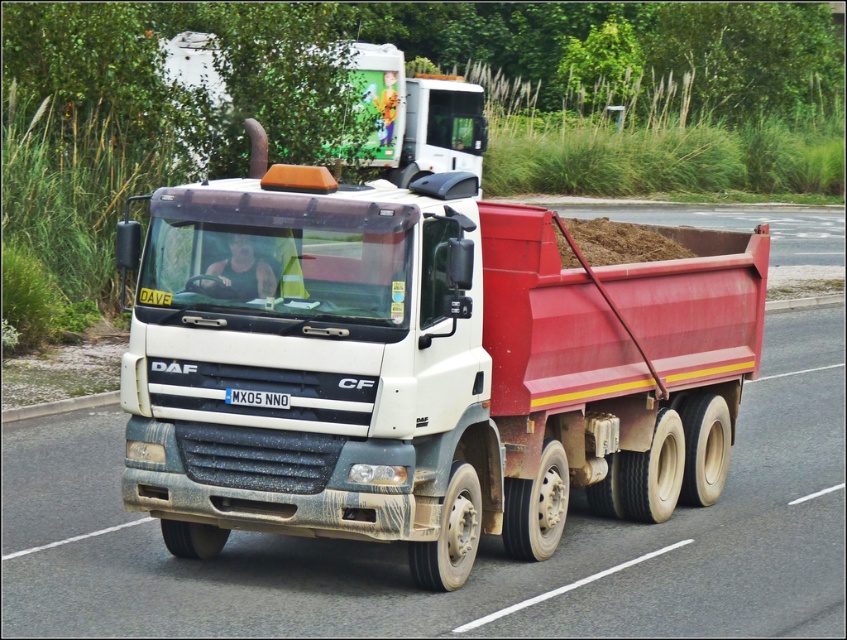
Consider the image. Is the position of dull white trailer truck at center more distant than that of white matte truck at upper center?

No, it is not.

What are the coordinates of `dull white trailer truck at center` in the screenshot? It's located at (419, 365).

I want to click on dull white trailer truck at center, so [419, 365].

Is white matte truck at upper center positioned at the back of black plastic license plate at center?

Yes, white matte truck at upper center is further from the viewer.

Who is taller, white matte truck at upper center or black plastic license plate at center?

Standing taller between the two is white matte truck at upper center.

Is point (380, 147) farther from camera compared to point (252, 403)?

Yes, point (380, 147) is behind point (252, 403).

Image resolution: width=847 pixels, height=640 pixels. I want to click on white matte truck at upper center, so click(414, 116).

Can you confirm if dull white trailer truck at center is smaller than black plastic license plate at center?

Actually, dull white trailer truck at center might be larger than black plastic license plate at center.

Which is in front, point (191, 493) or point (248, 390)?

Point (248, 390) is in front.

Locate an element on the screen. This screenshot has height=640, width=847. dull white trailer truck at center is located at coordinates (419, 365).